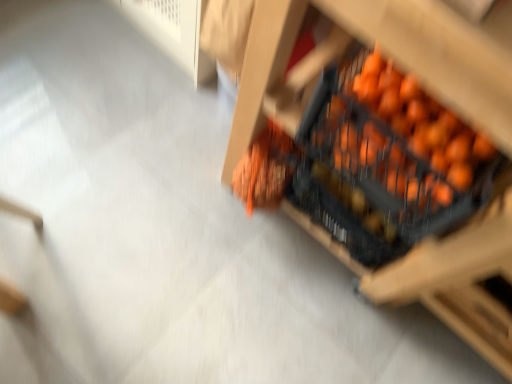
Question: Can you confirm if orange matte crate at center-right is smaller than orange matte crate at center?

Choices:
 (A) yes
 (B) no

Answer: (A)

Question: Is orange matte crate at center-right taller than orange matte crate at center?

Choices:
 (A) yes
 (B) no

Answer: (B)

Question: Is orange matte crate at center-right in contact with orange matte crate at center?

Choices:
 (A) no
 (B) yes

Answer: (B)

Question: From the image's perspective, is orange matte crate at center-right on orange matte crate at center?

Choices:
 (A) no
 (B) yes

Answer: (A)

Question: From the image's perspective, does orange matte crate at center-right appear lower than orange matte crate at center?

Choices:
 (A) yes
 (B) no

Answer: (A)

Question: Considering the relative sizes of orange matte crate at center-right and orange matte crate at center in the image provided, is orange matte crate at center-right shorter than orange matte crate at center?

Choices:
 (A) no
 (B) yes

Answer: (B)

Question: From the image's perspective, would you say orange matte crate at center is shown under orange matte crate at center-right?

Choices:
 (A) no
 (B) yes

Answer: (A)

Question: Is orange matte crate at center looking in the opposite direction of orange matte crate at center-right?

Choices:
 (A) yes
 (B) no

Answer: (A)

Question: Considering the relative positions of orange matte crate at center and orange matte crate at center-right in the image provided, is orange matte crate at center to the left of orange matte crate at center-right from the viewer's perspective?

Choices:
 (A) yes
 (B) no

Answer: (B)

Question: Is orange matte crate at center far away from orange matte crate at center-right?

Choices:
 (A) yes
 (B) no

Answer: (B)

Question: Is orange matte crate at center oriented towards orange matte crate at center-right?

Choices:
 (A) no
 (B) yes

Answer: (B)

Question: Is orange matte crate at center smaller than orange matte crate at center-right?

Choices:
 (A) no
 (B) yes

Answer: (A)

Question: Considering the positions of point (441, 112) and point (458, 92), is point (441, 112) closer or farther from the camera than point (458, 92)?

Choices:
 (A) farther
 (B) closer

Answer: (A)